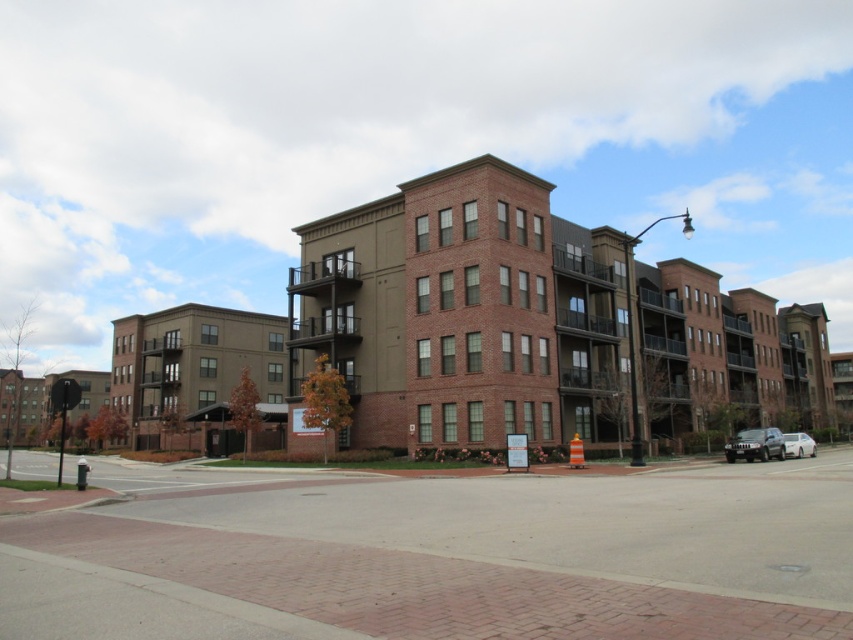
Between metallic silver suv at lower right and white glossy sedan at right, which one is positioned higher?

metallic silver suv at lower right is higher up.

Does point (750, 442) come closer to viewer compared to point (790, 452)?

Yes, point (750, 442) is in front of point (790, 452).

I want to click on metallic silver suv at lower right, so click(755, 444).